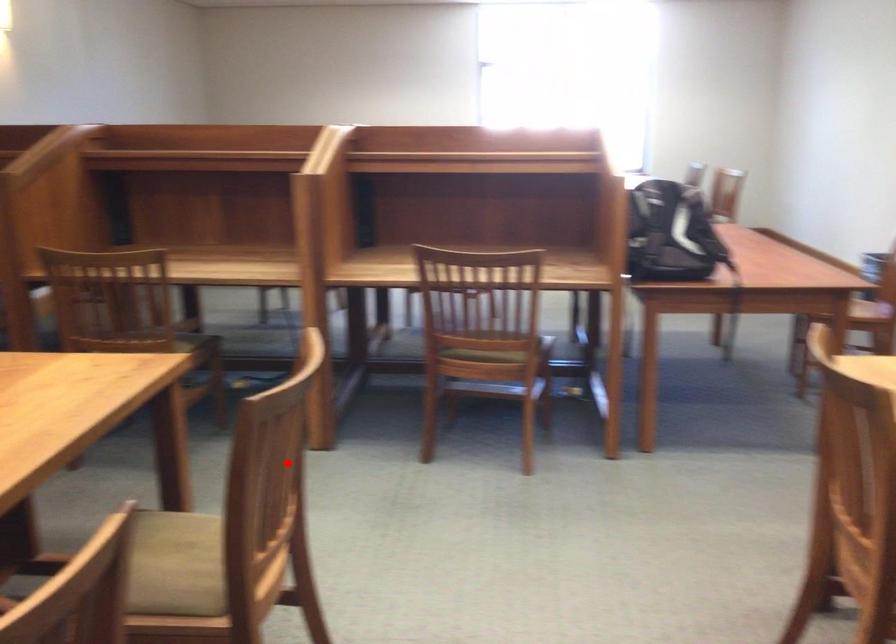
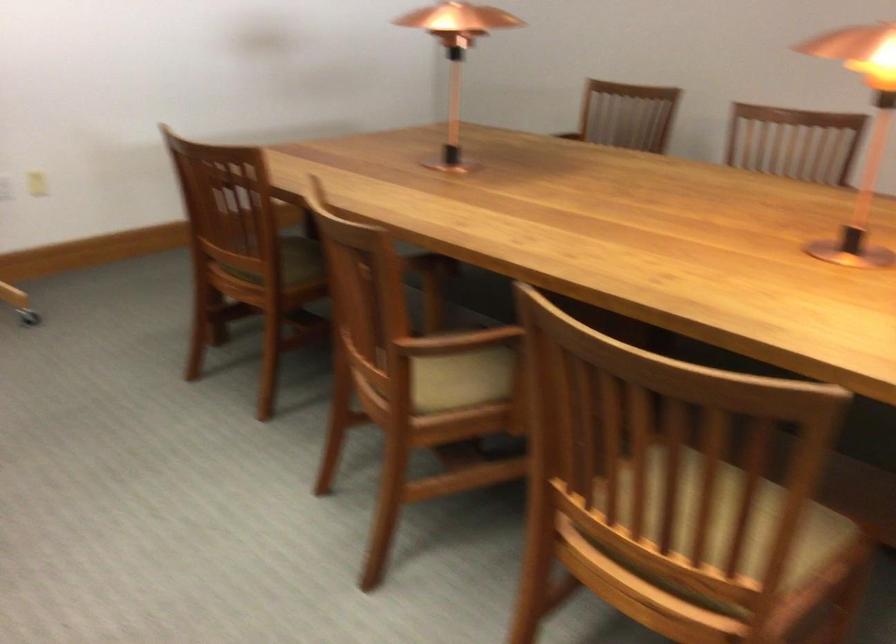
Locate, in the second image, the point that corresponds to the highlighted location in the first image.

(728, 526)